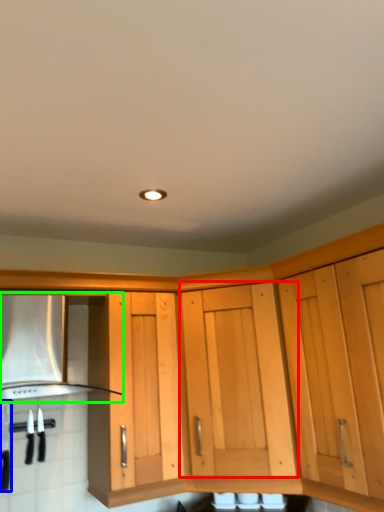
Question: Considering the real-world distances, which object is farthest from cabinetry (highlighted by a red box)? kitchen appliance (highlighted by a blue box) or vent (highlighted by a green box)?

Choices:
 (A) kitchen appliance
 (B) vent

Answer: (A)